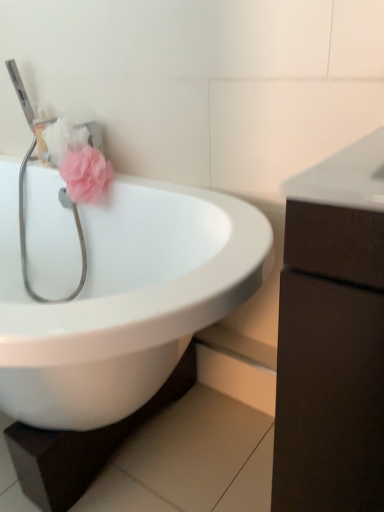
This screenshot has width=384, height=512. Describe the element at coordinates (332, 336) in the screenshot. I see `dark brown wood cabinet at right` at that location.

Image resolution: width=384 pixels, height=512 pixels. I want to click on pink fabric flower at upper left, so (x=86, y=174).

Locate an element on the screen. The width and height of the screenshot is (384, 512). white glossy sink at center is located at coordinates (123, 298).

Between pink fabric flower at upper left and metallic silver stethoscope at left, which one has less height?

pink fabric flower at upper left.

Which is in front, pink fabric flower at upper left or metallic silver stethoscope at left?

pink fabric flower at upper left is closer to the camera.

Identify the location of stethoscope that appears below the pink fabric flower at upper left (from the image's perspective). The width and height of the screenshot is (384, 512). (24, 234).

Is the depth of dark brown wood cabinet at right greater than that of pink fabric flower at upper left?

No, dark brown wood cabinet at right is in front of pink fabric flower at upper left.

Is point (381, 345) positioned behind point (108, 168)?

No, it is not.

How different are the orientations of dark brown wood cabinet at right and pink fabric flower at upper left in degrees?

dark brown wood cabinet at right and pink fabric flower at upper left are facing 83.5 degrees away from each other.

From the image's perspective, between dark brown wood cabinet at right and pink fabric flower at upper left, who is located below?

From the image's view, dark brown wood cabinet at right is below.

Does metallic silver stethoscope at left have a smaller size compared to white glossy sink at center?

Yes.

Between metallic silver stethoscope at left and white glossy sink at center, which one has smaller width?

With smaller width is metallic silver stethoscope at left.

Considering the sizes of objects metallic silver stethoscope at left and white glossy sink at center in the image provided, who is shorter, metallic silver stethoscope at left or white glossy sink at center?

metallic silver stethoscope at left is shorter.

In the scene shown: How many degrees apart are the facing directions of metallic silver stethoscope at left and white glossy sink at center?

0.347 degrees.

Relative to dark brown wood cabinet at right, is metallic silver stethoscope at left in front or behind?

In the image, metallic silver stethoscope at left appears behind dark brown wood cabinet at right.

Considering the sizes of metallic silver stethoscope at left and dark brown wood cabinet at right in the image, is metallic silver stethoscope at left wider or thinner than dark brown wood cabinet at right?

Clearly, metallic silver stethoscope at left has less width compared to dark brown wood cabinet at right.

Is metallic silver stethoscope at left far from dark brown wood cabinet at right?

Absolutely, metallic silver stethoscope at left is distant from dark brown wood cabinet at right.

From the image's perspective, who appears lower, metallic silver stethoscope at left or dark brown wood cabinet at right?

dark brown wood cabinet at right is shown below in the image.

Consider the image. Is white glossy sink at center bigger or smaller than dark brown wood cabinet at right?

Clearly, white glossy sink at center is larger in size than dark brown wood cabinet at right.

From the image's perspective, is white glossy sink at center located above or below dark brown wood cabinet at right?

From the image's perspective, white glossy sink at center appears above dark brown wood cabinet at right.

Visually, is white glossy sink at center positioned to the left or to the right of dark brown wood cabinet at right?

From the image, it's evident that white glossy sink at center is to the left of dark brown wood cabinet at right.

What's the angular difference between white glossy sink at center and dark brown wood cabinet at right's facing directions?

The angle between the facing direction of white glossy sink at center and the facing direction of dark brown wood cabinet at right is 1 degrees.

From the image's perspective, is pink fabric flower at upper left beneath white glossy sink at center?

Incorrect, from the image's perspective, pink fabric flower at upper left is higher than white glossy sink at center.

From the picture: Considering their positions, is pink fabric flower at upper left located in front of or behind white glossy sink at center?

pink fabric flower at upper left is behind white glossy sink at center.

Can you confirm if pink fabric flower at upper left is bigger than white glossy sink at center?

No.

Is pink fabric flower at upper left to the left of white glossy sink at center from the viewer's perspective?

In fact, pink fabric flower at upper left is to the right of white glossy sink at center.

Between metallic silver stethoscope at left and pink fabric flower at upper left, which one has larger size?

metallic silver stethoscope at left.

Are metallic silver stethoscope at left and pink fabric flower at upper left far apart?

No, metallic silver stethoscope at left is in close proximity to pink fabric flower at upper left.

Looking at their sizes, would you say metallic silver stethoscope at left is wider or thinner than pink fabric flower at upper left?

Clearly, metallic silver stethoscope at left has more width compared to pink fabric flower at upper left.

Considering the positions of objects metallic silver stethoscope at left and pink fabric flower at upper left in the image provided, who is more to the right, metallic silver stethoscope at left or pink fabric flower at upper left?

pink fabric flower at upper left.

Where is `flower on the right of metallic silver stethoscope at left`? flower on the right of metallic silver stethoscope at left is located at coordinates (86, 174).

Where is `bathroom cabinet lying in front of the pink fabric flower at upper left`? This screenshot has height=512, width=384. bathroom cabinet lying in front of the pink fabric flower at upper left is located at coordinates (332, 336).

From the image, which object appears to be farther from metallic silver stethoscope at left, white glossy sink at center or dark brown wood cabinet at right?

dark brown wood cabinet at right.

In the scene shown: From the image, which object appears to be farther from white glossy sink at center, pink fabric flower at upper left or dark brown wood cabinet at right?

dark brown wood cabinet at right is further to white glossy sink at center.

Looking at the image, which one is located further to metallic silver stethoscope at left, dark brown wood cabinet at right or white glossy sink at center?

Among the two, dark brown wood cabinet at right is located further to metallic silver stethoscope at left.

From the image, which object appears to be farther from white glossy sink at center, metallic silver stethoscope at left or dark brown wood cabinet at right?

dark brown wood cabinet at right is positioned further to the anchor white glossy sink at center.

Looking at the image, which one is located further to dark brown wood cabinet at right, white glossy sink at center or metallic silver stethoscope at left?

metallic silver stethoscope at left is further to dark brown wood cabinet at right.

Based on their spatial positions, is pink fabric flower at upper left or white glossy sink at center further from metallic silver stethoscope at left?

Based on the image, white glossy sink at center appears to be further to metallic silver stethoscope at left.

Looking at the image, which one is located closer to pink fabric flower at upper left, dark brown wood cabinet at right or white glossy sink at center?

white glossy sink at center is closer to pink fabric flower at upper left.

Based on their spatial positions, is white glossy sink at center or pink fabric flower at upper left closer to metallic silver stethoscope at left?

pink fabric flower at upper left.

This screenshot has height=512, width=384. Identify the location of stethoscope between white glossy sink at center and dark brown wood cabinet at right in the horizontal direction. (24, 234).

The image size is (384, 512). What are the coordinates of `flower between white glossy sink at center and dark brown wood cabinet at right from left to right` in the screenshot? It's located at (86, 174).

Where is `flower between white glossy sink at center and metallic silver stethoscope at left in the front-back direction`? The image size is (384, 512). flower between white glossy sink at center and metallic silver stethoscope at left in the front-back direction is located at coordinates (86, 174).

Find the location of a particular element. Image resolution: width=384 pixels, height=512 pixels. flower between dark brown wood cabinet at right and metallic silver stethoscope at left along the z-axis is located at coordinates (86, 174).